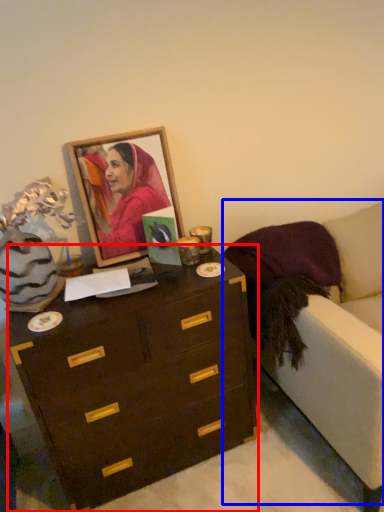
Question: Which object is closer to the camera taking this photo, chest of drawers (highlighted by a red box) or armchair (highlighted by a blue box)?

Choices:
 (A) chest of drawers
 (B) armchair

Answer: (B)